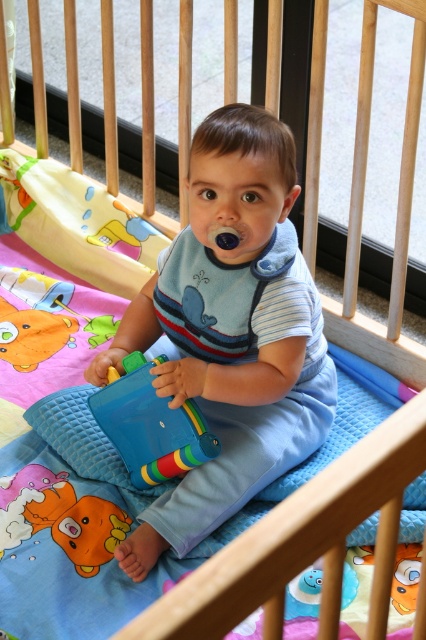
You are a parent checking on your baby in the crib. You see the blue plastic toy at center and the rubber duck at lower left. Which toy is closer to the baby?

The blue plastic toy at center is closer to the baby because the rubber duck at lower left is behind it.

Consider the image. You are a parent checking on your baby in the crib. You see a point marked at coordinates (x=230, y=332). Can you tell me what object this point is located on?

The point at coordinates (x=230, y=332) is located on the blue matte toy at center.

You are a parent standing near the crib and want to reach the point at coordinates point (164, 358) to retrieve an item. Considering your height, can you comfortably reach that point without climbing?

The distance between you and point (164, 358) is 1.66 meters. Since this distance is within a typical comfortable reaching range for an adult, you can likely reach it without needing to climb.